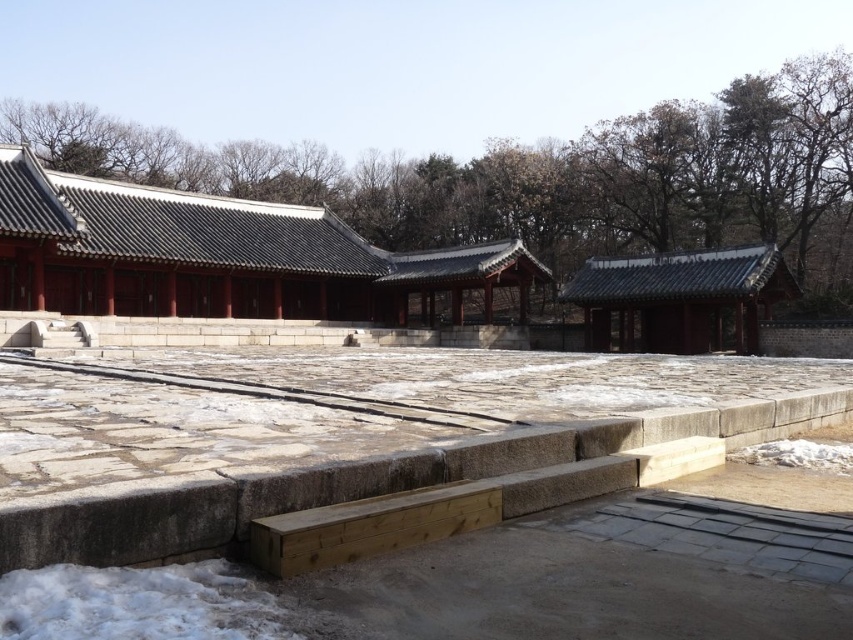
Question: Where is matte gray stone palace at center located in relation to shiny dark gray roof at right in the image?

Choices:
 (A) below
 (B) above

Answer: (B)

Question: In this image, where is matte gray stone palace at center located relative to shiny dark gray roof at right?

Choices:
 (A) below
 (B) above

Answer: (B)

Question: Can you confirm if matte gray stone palace at center is positioned to the left of shiny dark gray roof at right?

Choices:
 (A) yes
 (B) no

Answer: (A)